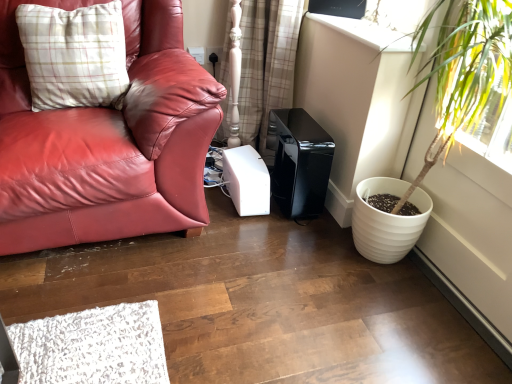
In order to face plaid fabric pillow at upper left, should I rotate leftwards or rightwards?

You should rotate left by 23.249 degrees.

Identify the location of plaid fabric curtain at center. (266, 63).

From the picture: Measure the distance between point (347, 1) and camera.

Point (347, 1) is 1.86 meters from camera.

What are the coordinates of `plaid fabric pillow at upper left` in the screenshot? It's located at (74, 55).

In the scene shown: Is white textured pot at right at the back of plaid fabric curtain at center?

plaid fabric curtain at center does not have its back to white textured pot at right.

Does plaid fabric curtain at center appear on the left side of white textured pot at right?

Yes.

Is plaid fabric curtain at center inside the boundaries of white textured pot at right, or outside?

plaid fabric curtain at center is spatially situated outside white textured pot at right.

Is plaid fabric curtain at center further to camera compared to white textured pot at right?

Yes, the depth of plaid fabric curtain at center is greater than that of white textured pot at right.

Is transparent plastic window screen at upper center oriented towards plaid fabric pillow at upper left?

No, transparent plastic window screen at upper center is not oriented towards plaid fabric pillow at upper left.

From the image's perspective, who appears lower, transparent plastic window screen at upper center or plaid fabric pillow at upper left?

plaid fabric pillow at upper left appears lower in the image.

Consider the image. Which of these two, transparent plastic window screen at upper center or plaid fabric pillow at upper left, is bigger?

plaid fabric pillow at upper left.

Between transparent plastic window screen at upper center and plaid fabric pillow at upper left, which one has larger width?

With larger width is plaid fabric pillow at upper left.

Is white glossy window sill at upper right oriented towards white textured pot at right?

No, white glossy window sill at upper right does not turn towards white textured pot at right.

What's the angular difference between white glossy window sill at upper right and white textured pot at right's facing directions?

They differ by 0.915 degrees in their facing directions.

Does white glossy window sill at upper right contain white textured pot at right?

That's incorrect, white textured pot at right is not inside white glossy window sill at upper right.

Is white textured pot at right not inside plaid fabric pillow at upper left?

white textured pot at right is positioned outside plaid fabric pillow at upper left.

From a real-world perspective, between white textured pot at right and plaid fabric pillow at upper left, who is vertically lower?

white textured pot at right is physically lower.

Can you tell me how much white textured pot at right and plaid fabric pillow at upper left differ in facing direction?

The facing directions of white textured pot at right and plaid fabric pillow at upper left are 74.6 degrees apart.

Measure the distance between white textured pot at right and plaid fabric pillow at upper left.

The distance of white textured pot at right from plaid fabric pillow at upper left is 1.20 meters.

Would you consider white textured pot at right to be distant from transparent plastic window screen at upper center?

No, white textured pot at right is not far from transparent plastic window screen at upper center.

Who is bigger, white textured pot at right or transparent plastic window screen at upper center?

Bigger between the two is white textured pot at right.

At what (x,y) coordinates should I click in order to perform the action: click on houseplant in front of the transparent plastic window screen at upper center. Please return your answer as a coordinate pair (x, y). Looking at the image, I should click on (444, 115).

Is white textured pot at right at the left side of transparent plastic window screen at upper center?

In fact, white textured pot at right is to the right of transparent plastic window screen at upper center.

Between transparent plastic window screen at upper center and plaid fabric curtain at center, which one has smaller width?

With smaller width is transparent plastic window screen at upper center.

In terms of size, does transparent plastic window screen at upper center appear bigger or smaller than plaid fabric curtain at center?

Clearly, transparent plastic window screen at upper center is smaller in size than plaid fabric curtain at center.

Is transparent plastic window screen at upper center further to the viewer compared to plaid fabric curtain at center?

No, it is not.

Considering the points (343, 0) and (252, 87), which point is behind, point (343, 0) or point (252, 87)?

The point (252, 87) is behind.

Locate an element on the screen. The height and width of the screenshot is (384, 512). pillow above the white textured pot at right (from a real-world perspective) is located at coordinates (74, 55).

Does plaid fabric pillow at upper left have a larger size compared to white textured pot at right?

No.

From the picture: Is plaid fabric pillow at upper left to the left or to the right of white textured pot at right in the image?

Based on their positions, plaid fabric pillow at upper left is located to the left of white textured pot at right.

Identify the location of curtain on the left of white textured pot at right. (266, 63).

Find the location of a particular element. The image size is (512, 384). pillow in front of the transparent plastic window screen at upper center is located at coordinates (74, 55).

In the scene shown: From the image, which object appears to be nearer to transparent plastic window screen at upper center, white textured pot at right or plaid fabric pillow at upper left?

white textured pot at right is positioned closer to the anchor transparent plastic window screen at upper center.

Based on the photo, looking at the image, which one is located further to white textured pot at right, plaid fabric pillow at upper left or plaid fabric curtain at center?

plaid fabric pillow at upper left lies further to white textured pot at right than the other object.

In the scene shown: When comparing their distances from plaid fabric pillow at upper left, does transparent plastic window screen at upper center or plaid fabric curtain at center seem closer?

plaid fabric curtain at center.

When comparing their distances from white textured pot at right, does transparent plastic window screen at upper center or white glossy window sill at upper right seem further?

transparent plastic window screen at upper center lies further to white textured pot at right than the other object.

Considering their positions, is plaid fabric pillow at upper left positioned closer to transparent plastic window screen at upper center than white glossy window sill at upper right?

Based on the image, white glossy window sill at upper right appears to be nearer to transparent plastic window screen at upper center.

Which object lies further to the anchor point white textured pot at right, transparent plastic window screen at upper center or plaid fabric curtain at center?

Based on the image, plaid fabric curtain at center appears to be further to white textured pot at right.

Considering their positions, is plaid fabric curtain at center positioned further to transparent plastic window screen at upper center than white glossy window sill at upper right?

The object further to transparent plastic window screen at upper center is plaid fabric curtain at center.

Estimate the real-world distances between objects in this image. Which object is further from plaid fabric pillow at upper left, white glossy window sill at upper right or white textured pot at right?

Based on the image, white textured pot at right appears to be further to plaid fabric pillow at upper left.

At what (x,y) coordinates should I click in order to perform the action: click on window sill positioned between white textured pot at right and transparent plastic window screen at upper center from near to far. Please return your answer as a coordinate pair (x, y). Image resolution: width=512 pixels, height=384 pixels. Looking at the image, I should click on (366, 33).

You are a GUI agent. You are given a task and a screenshot of the screen. Output one action in this format:
    pyautogui.click(x=<x>, y=<y>)
    Task: Click on the window screen between plaid fabric pillow at upper left and white textured pot at right from left to right
    
    Given the screenshot: What is the action you would take?
    pyautogui.click(x=338, y=8)

In order to click on window sill between white textured pot at right and plaid fabric curtain at center from front to back in this screenshot , I will do `click(366, 33)`.

Find the location of a particular element. This screenshot has height=384, width=512. curtain between plaid fabric pillow at upper left and white glossy window sill at upper right is located at coordinates (266, 63).